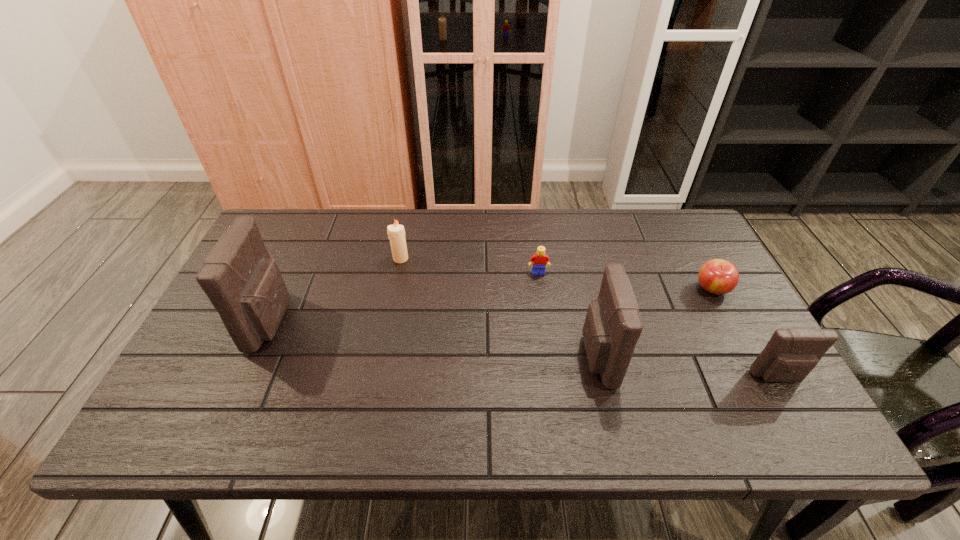
Please point a spot to place another pouch for symmetrical spacing. Please provide its 2D coordinates. Your answer should be formatted as a tuple, i.e. [(x, y)], where the tuple contains the x and y coordinates of a point satisfying the conditions above.

[(428, 339)]